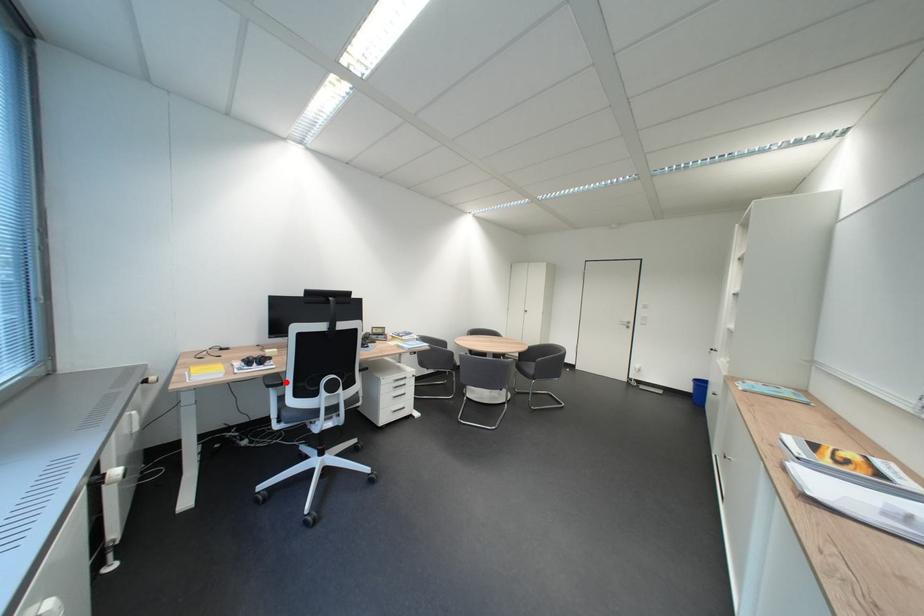
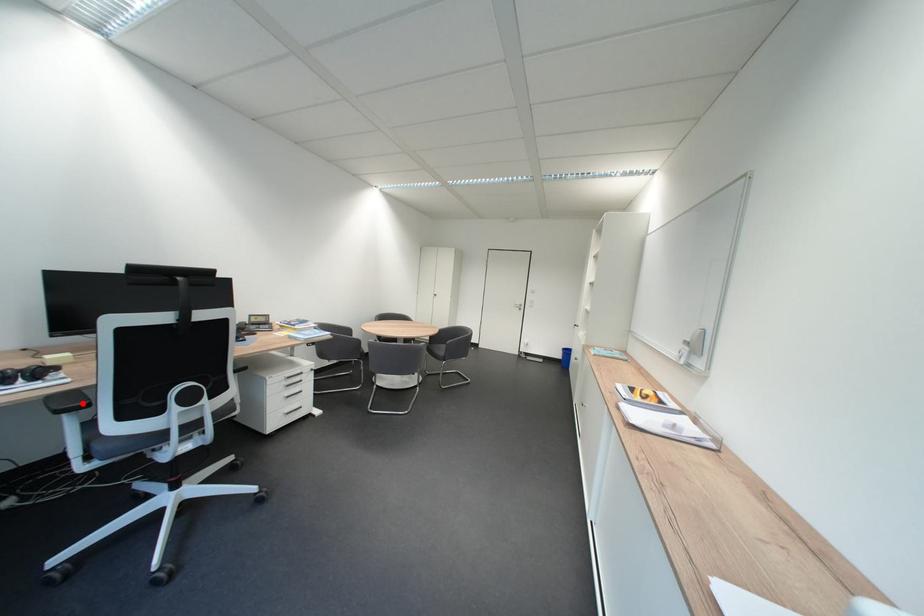
I am providing you with two images of the same scene from different viewpoints. A red point is marked on the first image and another point is marked on the second image. Do the highlighted points in image1 and image2 indicate the same real-world spot?

Yes